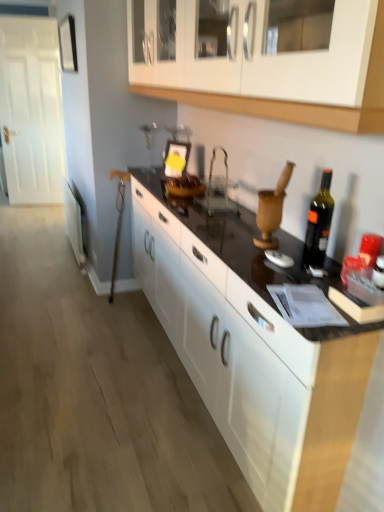
Question: Considering the relative sizes of white glossy cabinet at upper center and black glass bottle at right in the image provided, is white glossy cabinet at upper center taller than black glass bottle at right?

Choices:
 (A) no
 (B) yes

Answer: (B)

Question: Considering the relative positions of white glossy cabinet at upper center and black glass bottle at right in the image provided, is white glossy cabinet at upper center in front of black glass bottle at right?

Choices:
 (A) no
 (B) yes

Answer: (B)

Question: From the image's perspective, does white glossy cabinet at upper center appear higher than black glass bottle at right?

Choices:
 (A) no
 (B) yes

Answer: (B)

Question: Is white glossy cabinet at upper center positioned with its back to black glass bottle at right?

Choices:
 (A) no
 (B) yes

Answer: (A)

Question: Does white glossy cabinet at upper center have a larger size compared to black glass bottle at right?

Choices:
 (A) yes
 (B) no

Answer: (A)

Question: From a real-world perspective, is white glossy cabinet at upper center positioned over black glass bottle at right based on gravity?

Choices:
 (A) yes
 (B) no

Answer: (A)

Question: Is black glass bottle at right taller than white glossy cabinet at upper center?

Choices:
 (A) no
 (B) yes

Answer: (A)

Question: Are black glass bottle at right and white glossy cabinet at upper center far apart?

Choices:
 (A) no
 (B) yes

Answer: (A)

Question: Are black glass bottle at right and white glossy cabinet at upper center beside each other?

Choices:
 (A) no
 (B) yes

Answer: (A)

Question: Is black glass bottle at right thinner than white glossy cabinet at upper center?

Choices:
 (A) yes
 (B) no

Answer: (A)

Question: Is black glass bottle at right to the right of white glossy cabinet at upper center from the viewer's perspective?

Choices:
 (A) no
 (B) yes

Answer: (B)

Question: Is black glass bottle at right closer to the viewer compared to white glossy cabinet at upper center?

Choices:
 (A) yes
 (B) no

Answer: (B)

Question: Is black glass bottle at right behind black glossy countertop at center?

Choices:
 (A) no
 (B) yes

Answer: (B)